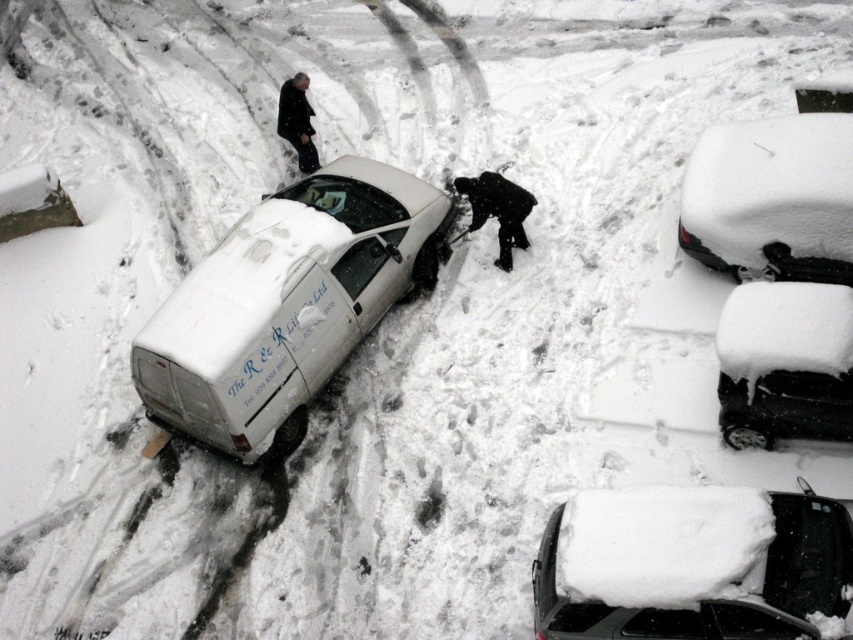
Which is in front, point (721, 529) or point (305, 122)?

Positioned in front is point (721, 529).

Can you confirm if snow-covered car at lower right is shorter than dark wool coat at upper center?

In fact, snow-covered car at lower right may be taller than dark wool coat at upper center.

Does point (601, 541) come behind point (305, 157)?

No, it is in front of (305, 157).

At what (x,y) coordinates should I click in order to perform the action: click on snow-covered car at lower right. Please return your answer as a coordinate pair (x, y). Looking at the image, I should click on (692, 564).

What do you see at coordinates (287, 304) in the screenshot? I see `white matte van at center` at bounding box center [287, 304].

Is white matte van at center bigger than white matte car at upper right?

Yes, white matte van at center is bigger than white matte car at upper right.

Between point (238, 276) and point (740, 138), which one is positioned behind?

Point (740, 138)

Find the location of `white matte van at center`. white matte van at center is located at coordinates [x=287, y=304].

Does point (727, 385) come farther from viewer compared to point (312, 168)?

That is False.

Image resolution: width=853 pixels, height=640 pixels. I want to click on black glossy car at lower right, so click(785, 364).